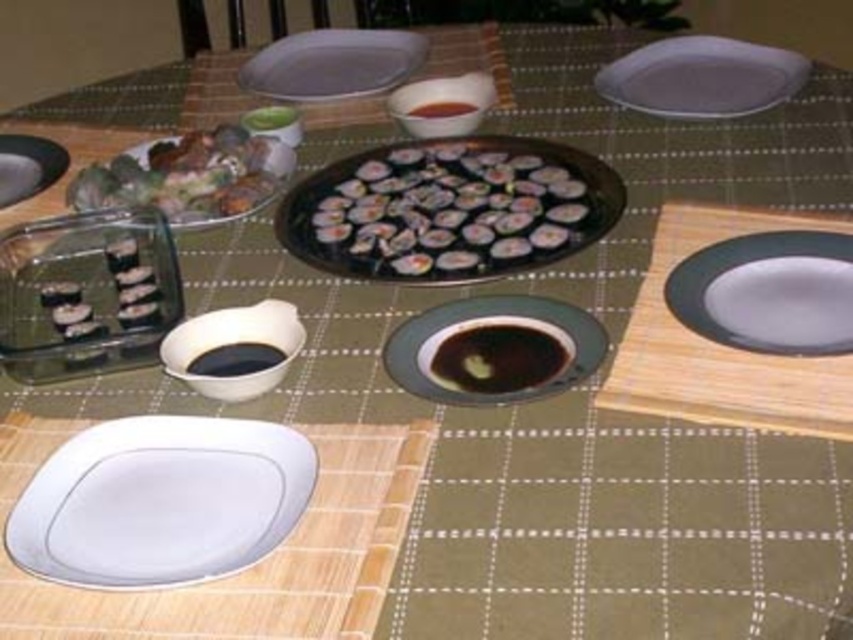
Does point (546, 209) lie in front of point (676, 70)?

Yes, point (546, 209) is closer to viewer.

Is sushi at center below white glossy plate at upper right?

Yes.

Does point (498, 173) come farther from viewer compared to point (786, 77)?

No, (498, 173) is closer to viewer.

Where is `sushi at center`? The image size is (853, 640). sushi at center is located at coordinates (450, 211).

Who is positioned more to the right, white glossy plate at lower left or black glossy soy sauce at center?

black glossy soy sauce at center

Describe the element at coordinates (160, 500) in the screenshot. This screenshot has height=640, width=853. I see `white glossy plate at lower left` at that location.

Where is `white glossy plate at lower left`? The height and width of the screenshot is (640, 853). white glossy plate at lower left is located at coordinates (160, 500).

Can you confirm if white glossy plate at lower left is smaller than brown glossy soy sauce at center?

No.

Which is above, white glossy plate at lower left or brown glossy soy sauce at center?

Positioned higher is brown glossy soy sauce at center.

What do you see at coordinates (160, 500) in the screenshot? The height and width of the screenshot is (640, 853). I see `white glossy plate at lower left` at bounding box center [160, 500].

Locate an element on the screen. This screenshot has width=853, height=640. white glossy plate at lower left is located at coordinates (160, 500).